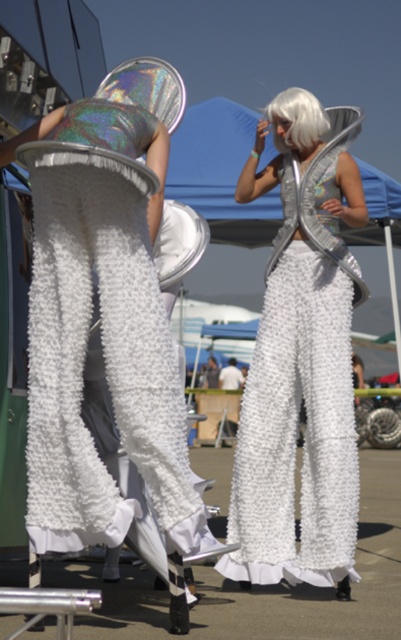
You are a photographer at the event and want to capture a photo where both the metallic silver pole at center and the white fluffy wig at upper center are clearly visible. Based on their positions, which object should you focus on first to ensure both are in frame?

Result: The metallic silver pole at center is below the white fluffy wig at upper center, so you should focus on the white fluffy wig at upper center first to ensure both are in frame.

You are a photographer standing at the event and want to capture a closeup shot of the white fluffy pants at center. Given that your camera has a minimum focusing distance of 10 feet, will you be able to take the photo without moving closer?

The white fluffy pants at center are 12.14 feet away from the viewer. Since the camera can focus as close as 10 feet, you can take the photo without moving closer because the distance is within the camera s focusing range.

You are a photographer positioned at the center of the scene. You want to capture a photo focusing on the white fluffy pants at center. Which performer should you adjust your camera towards?

The white fluffy pants at center belong to the performer on the right, so you should adjust your camera towards the performer on the right.